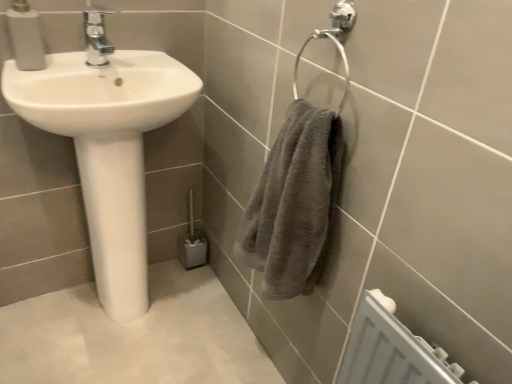
Question: From a real-world perspective, is chrome metallic faucet at upper center located beneath white glossy sink at left?

Choices:
 (A) no
 (B) yes

Answer: (A)

Question: Considering the relative positions of chrome metallic faucet at upper center and white glossy sink at left in the image provided, is chrome metallic faucet at upper center to the right of white glossy sink at left from the viewer's perspective?

Choices:
 (A) yes
 (B) no

Answer: (A)

Question: Is there a large distance between chrome metallic faucet at upper center and white glossy sink at left?

Choices:
 (A) no
 (B) yes

Answer: (A)

Question: Can you confirm if chrome metallic faucet at upper center is smaller than white glossy sink at left?

Choices:
 (A) no
 (B) yes

Answer: (B)

Question: Can you confirm if chrome metallic faucet at upper center is bigger than white glossy sink at left?

Choices:
 (A) no
 (B) yes

Answer: (A)

Question: Is chrome metallic faucet at upper center not inside white glossy sink at left?

Choices:
 (A) yes
 (B) no

Answer: (A)

Question: Is white glossy sink at left far away from matte white soap dispenser at upper left?

Choices:
 (A) yes
 (B) no

Answer: (B)

Question: Can you confirm if white glossy sink at left is thinner than matte white soap dispenser at upper left?

Choices:
 (A) no
 (B) yes

Answer: (A)

Question: Considering the relative positions of white glossy sink at left and matte white soap dispenser at upper left in the image provided, is white glossy sink at left to the right of matte white soap dispenser at upper left from the viewer's perspective?

Choices:
 (A) no
 (B) yes

Answer: (B)

Question: Can you confirm if white glossy sink at left is taller than matte white soap dispenser at upper left?

Choices:
 (A) yes
 (B) no

Answer: (A)

Question: Considering the relative sizes of white glossy sink at left and matte white soap dispenser at upper left in the image provided, is white glossy sink at left bigger than matte white soap dispenser at upper left?

Choices:
 (A) no
 (B) yes

Answer: (B)

Question: Does white glossy sink at left have a smaller size compared to matte white soap dispenser at upper left?

Choices:
 (A) no
 (B) yes

Answer: (A)

Question: Could you tell me if white glossy sink at left is facing gray fluffy towel at right?

Choices:
 (A) yes
 (B) no

Answer: (A)